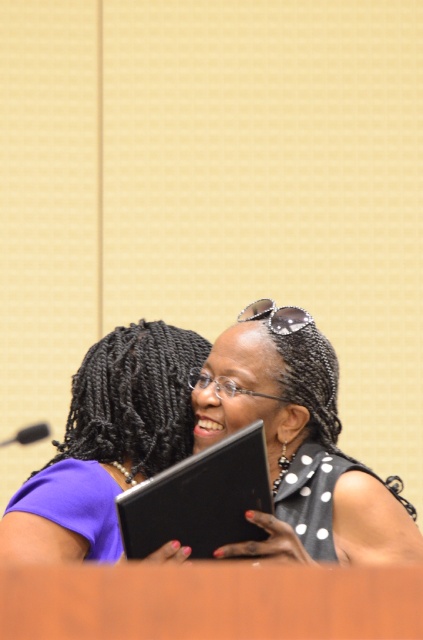
Does point (373, 490) come closer to viewer compared to point (87, 499)?

Yes, it is.

Does black dotted dress at center appear under purple matte dress at center?

Actually, black dotted dress at center is above purple matte dress at center.

Is point (255, 307) in front of point (114, 369)?

Yes, it is in front of point (114, 369).

Where is `black dotted dress at center`? Image resolution: width=423 pixels, height=640 pixels. black dotted dress at center is located at coordinates (299, 444).